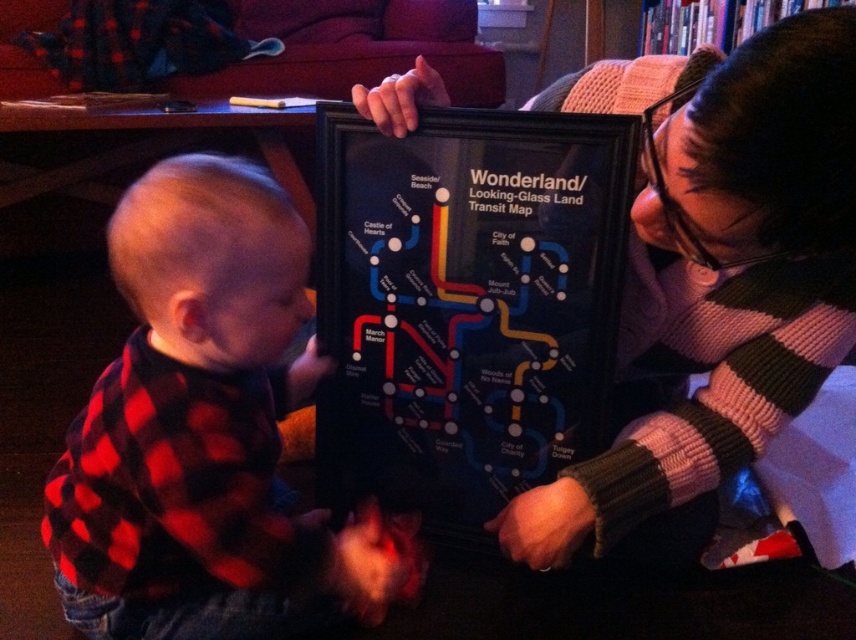
You are a tour guide at the Wonderland Transit Museum. Two visitors are looking at the framed map. The knitted sweater at center and red plaid shirt at left are both touching the frame. Can you determine which visitor is closer to the front of the display?

The knitted sweater at center is in front of red plaid shirt at left, so the visitor wearing the knitted sweater at center is closer to the front of the display.

You are a fashion designer observing two people interacting with a transit map. You need to determine which clothing item is bigger between the knitted sweater at center and the red plaid shirt at left. Which one should you choose?

The knitted sweater at center is larger in size compared to the red plaid shirt at left, so you should choose the knitted sweater at center.

You are a tour guide explaining the map to visitors. You notice the knitted sweater at center and the red plaid shirt at left. Which visitor is positioned higher on the map?

The knitted sweater at center is located above the red plaid shirt at left, so the visitor wearing the knitted sweater at center is positioned higher on the map.